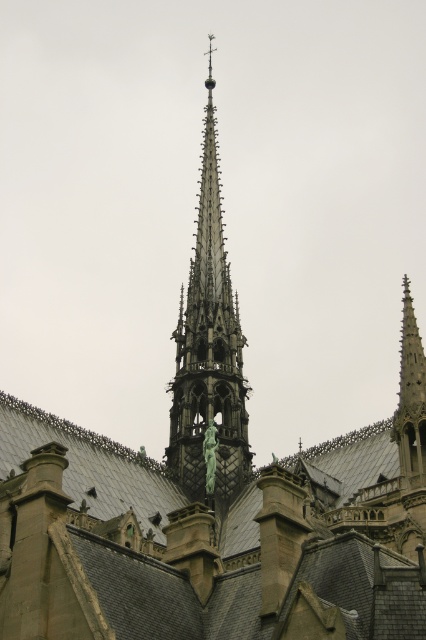
Can you confirm if dark gray stone spire at center is wider than green marble statue at upper center?

Correct, the width of dark gray stone spire at center exceeds that of green marble statue at upper center.

Can you confirm if dark gray stone spire at center is positioned above green marble statue at upper center?

Correct, dark gray stone spire at center is located above green marble statue at upper center.

Locate an element on the screen. Image resolution: width=426 pixels, height=640 pixels. dark gray stone spire at center is located at coordinates (209, 348).